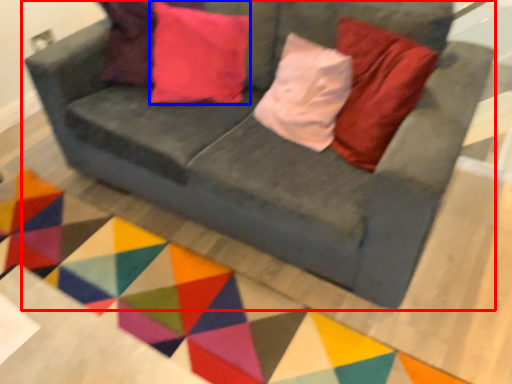
Question: Among these objects, which one is farthest to the camera, studio couch (highlighted by a red box) or pillow (highlighted by a blue box)?

Choices:
 (A) studio couch
 (B) pillow

Answer: (B)